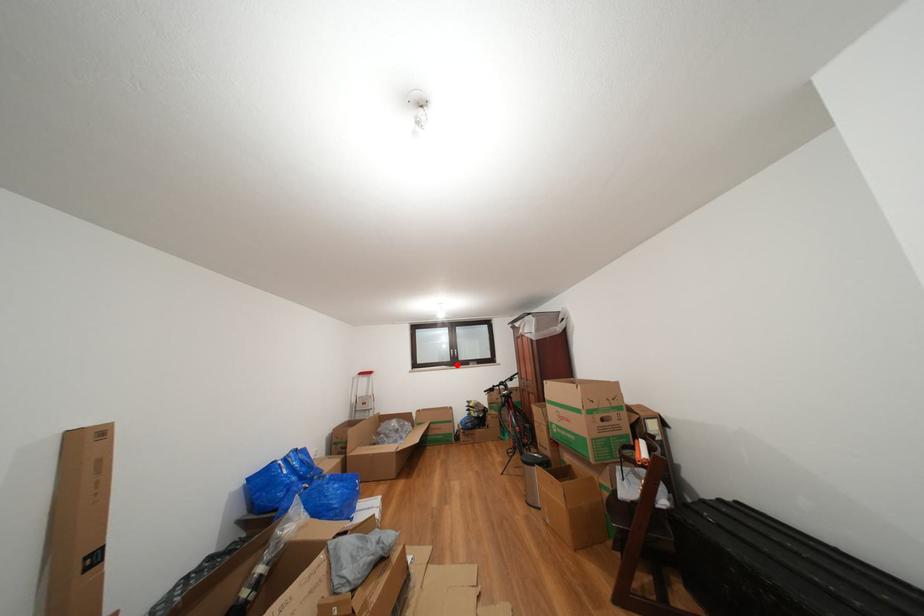
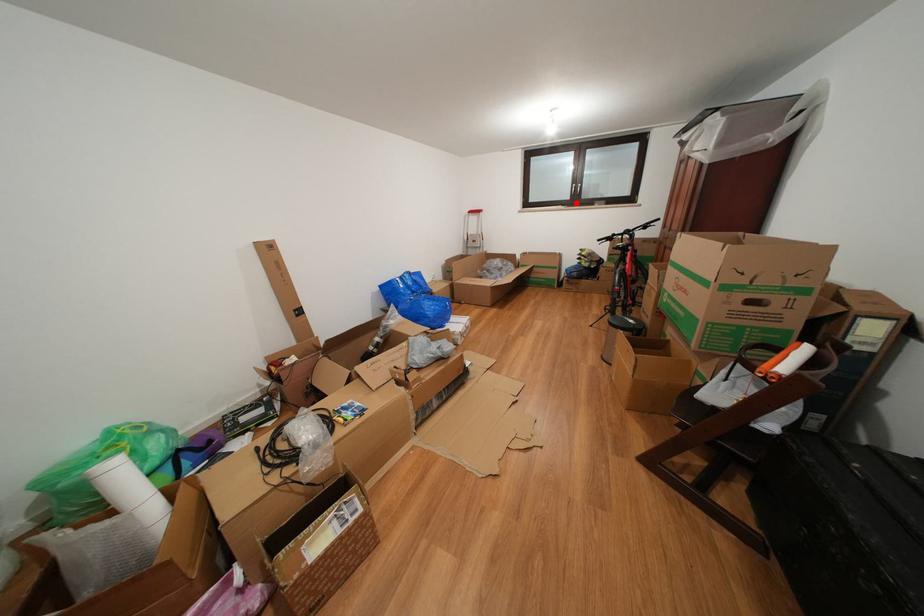
I am providing you with two images of the same scene from different viewpoints. A red point is marked on the first image and another point is marked on the second image. Are the points marked in image1 and image2 representing the same 3D position?

Yes